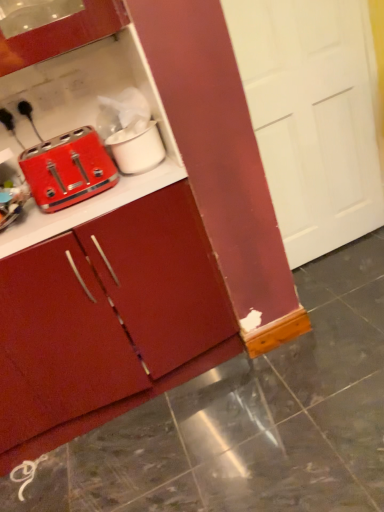
Locate an element on the screen. The width and height of the screenshot is (384, 512). empty space that is ontop of white matte pot at upper center (from a real-world perspective) is located at coordinates (123, 131).